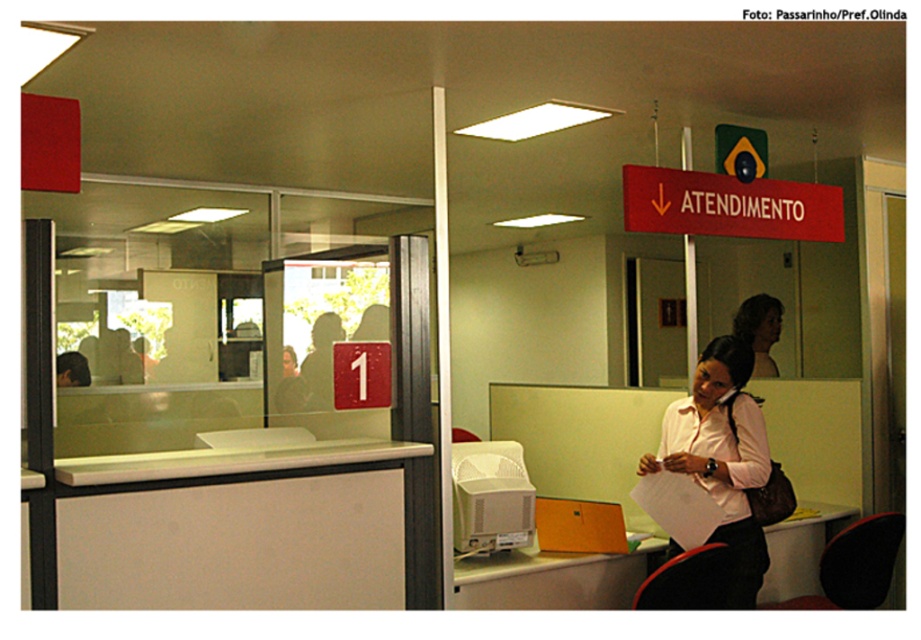
Which of these two, white matte desk at center or matte white blouse at center, stands shorter?

matte white blouse at center is shorter.

Measure the distance between white matte desk at center and matte white blouse at center.

white matte desk at center is 3.03 meters from matte white blouse at center.

Between point (67, 502) and point (762, 364), which one is positioned behind?

The point (762, 364) is more distant.

Find the location of `white matte desk at center`. white matte desk at center is located at coordinates (243, 529).

Between point (522, 600) and point (754, 328), which one is positioned behind?

Point (754, 328)

Between white plastic printer at center and matte white blouse at center, which one appears on the right side from the viewer's perspective?

From the viewer's perspective, matte white blouse at center appears more on the right side.

Is point (493, 604) positioned behind point (753, 305)?

No, (493, 604) is in front of (753, 305).

Locate an element on the screen. The height and width of the screenshot is (640, 921). white plastic printer at center is located at coordinates (554, 579).

This screenshot has width=921, height=640. What do you see at coordinates (243, 529) in the screenshot?
I see `white matte desk at center` at bounding box center [243, 529].

Is point (309, 600) behind point (754, 568)?

No, (309, 600) is closer to viewer.

What do you see at coordinates (243, 529) in the screenshot?
I see `white matte desk at center` at bounding box center [243, 529].

This screenshot has width=921, height=640. Identify the location of white matte desk at center. (243, 529).